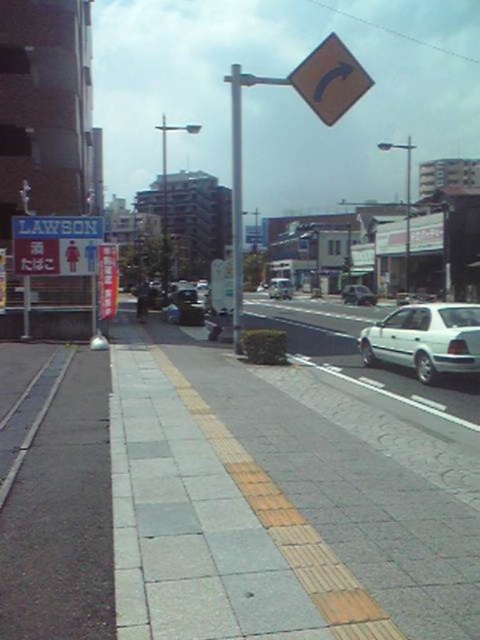
Is white glossy sedan at right further to camera compared to silver metallic car at center?

No, it is not.

Consider the image. Who is positioned more to the left, white glossy sedan at right or silver metallic car at center?

white glossy sedan at right

Locate an element on the screen. The image size is (480, 640). white glossy sedan at right is located at coordinates (425, 339).

This screenshot has height=640, width=480. Identify the location of white glossy sedan at right. (425, 339).

Is point (372, 298) behind point (279, 282)?

No, it is not.

What do you see at coordinates (358, 294) in the screenshot? I see `metallic silver car at center` at bounding box center [358, 294].

Is point (345, 296) positioned behind point (283, 289)?

No, (345, 296) is closer to viewer.

Locate an element on the screen. metallic silver car at center is located at coordinates (358, 294).

Does concrete pavement at lower left have a lesser width compared to yellow matte traffic sign at upper center?

Yes.

Is point (73, 428) more distant than point (332, 56)?

No, (73, 428) is closer to viewer.

Which is behind, point (54, 356) or point (307, 77)?

The point (54, 356) is behind.

Image resolution: width=480 pixels, height=640 pixels. In order to click on concrete pavement at lower left in this screenshot , I will do `click(56, 493)`.